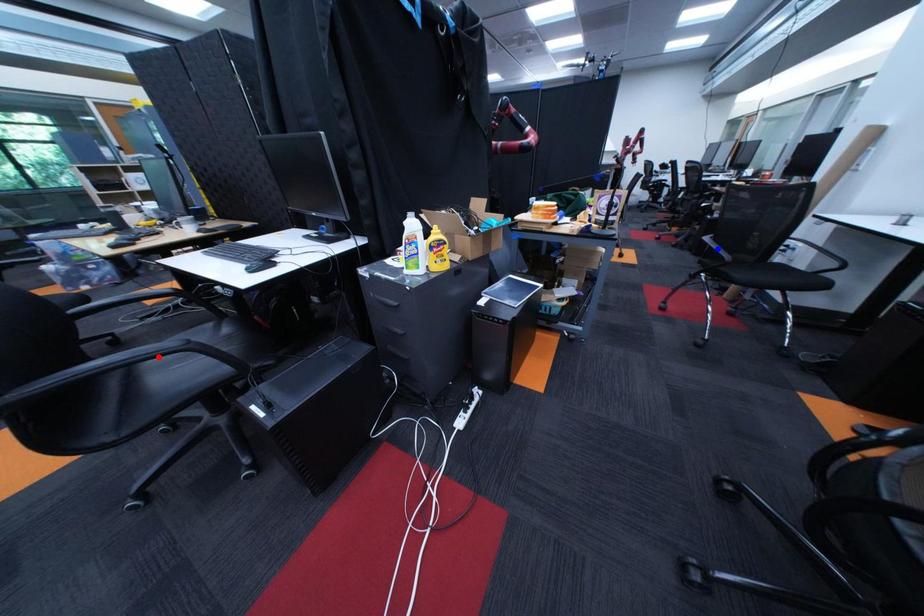
Question: Two points are marked on the image. Which point is closer to the camera?

Choices:
 (A) Blue point is closer.
 (B) Red point is closer.

Answer: (B)